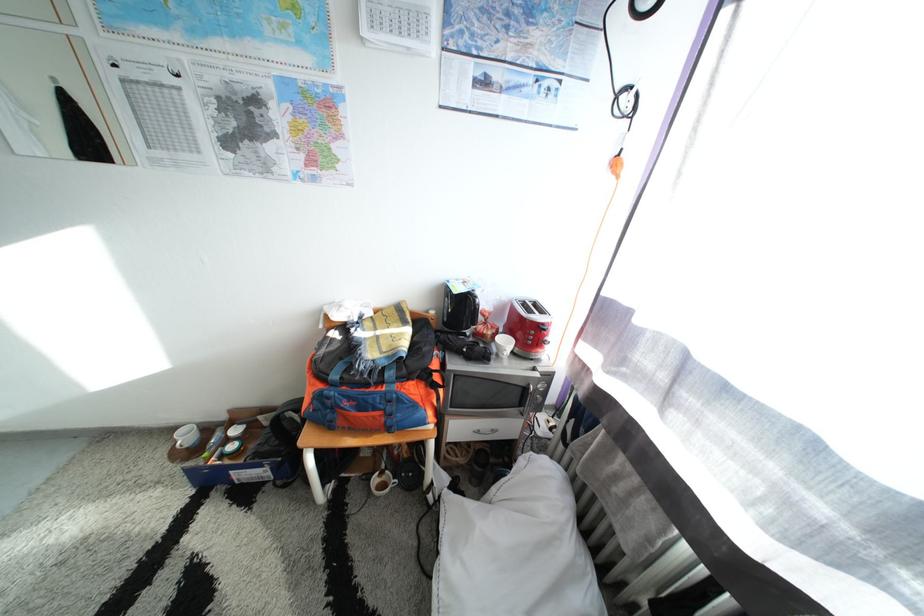
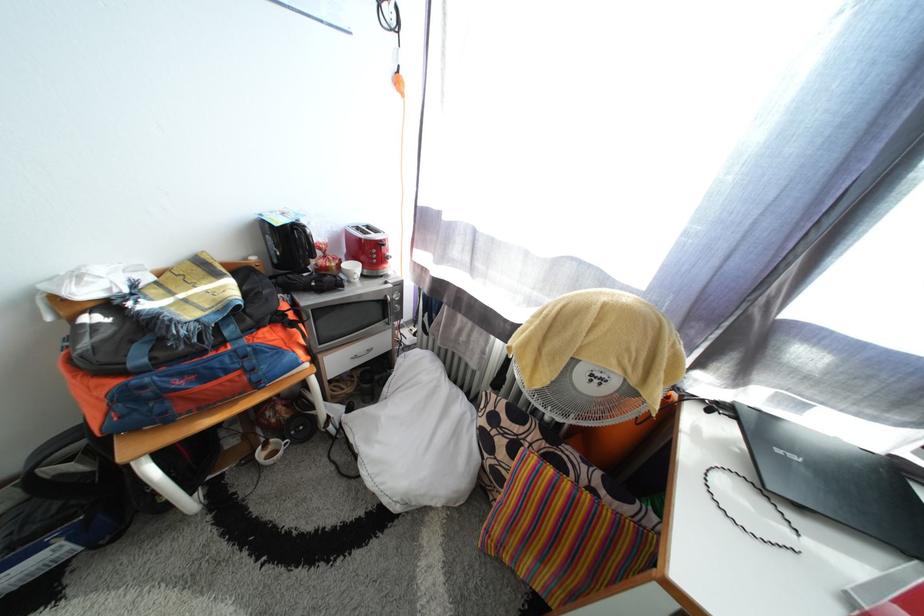
Where in the second image is the point corresponding to point 531,391 from the first image?

(390, 304)